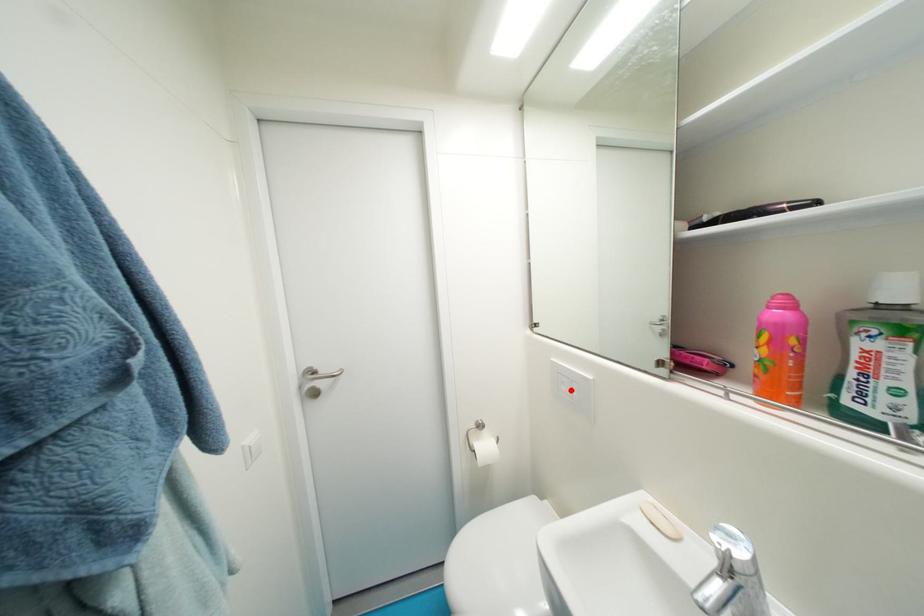
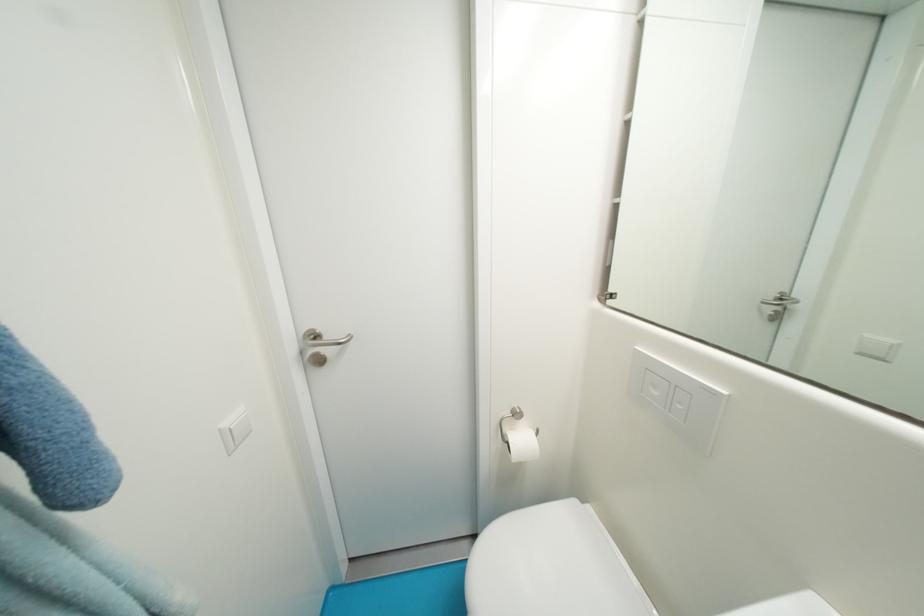
Locate, in the second image, the point that corresponds to the highlighted location in the first image.

(662, 395)